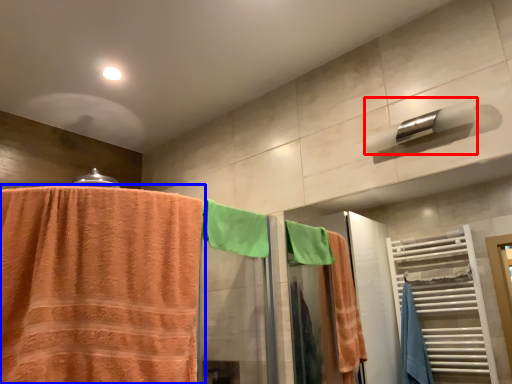
Question: Which object is closer to the camera taking this photo, towel bar (highlighted by a red box) or towel (highlighted by a blue box)?

Choices:
 (A) towel bar
 (B) towel

Answer: (B)